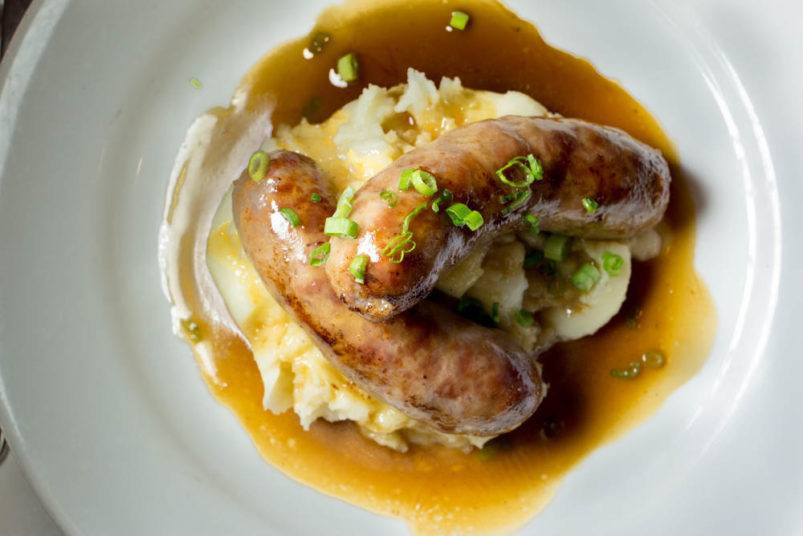
You are a GUI agent. You are given a task and a screenshot of the screen. Output one action in this format:
    pyautogui.click(x=<x>, y=<y>)
    Task: Click on the table
    This screenshot has width=803, height=536.
    Given the screenshot: What is the action you would take?
    18,521, 6,20